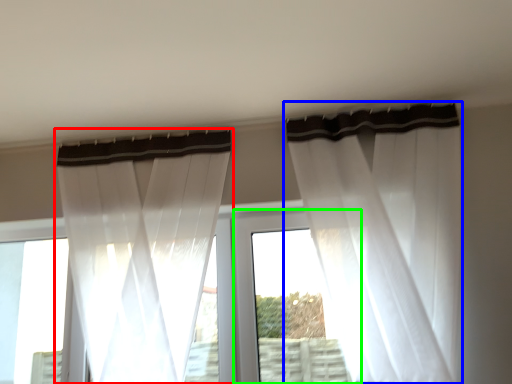
Question: Which object is the farthest from curtain (highlighted by a red box)? Choose among these: curtain (highlighted by a blue box) or window frame (highlighted by a green box).

Choices:
 (A) curtain
 (B) window frame

Answer: (A)